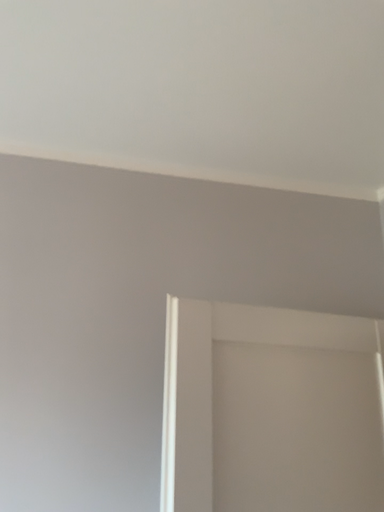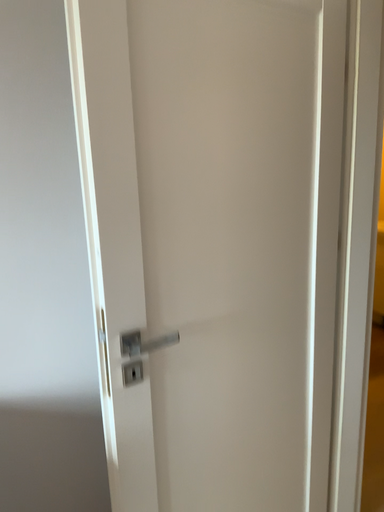
Question: How did the camera likely rotate when shooting the video?

Choices:
 (A) rotated right
 (B) rotated left

Answer: (A)